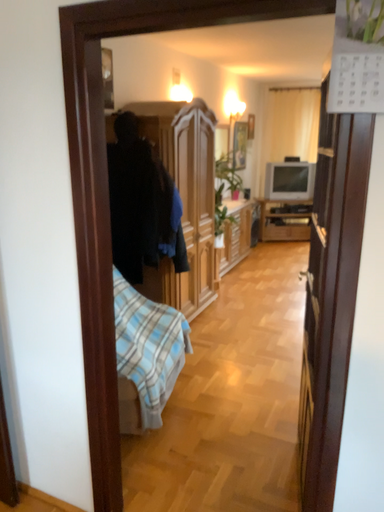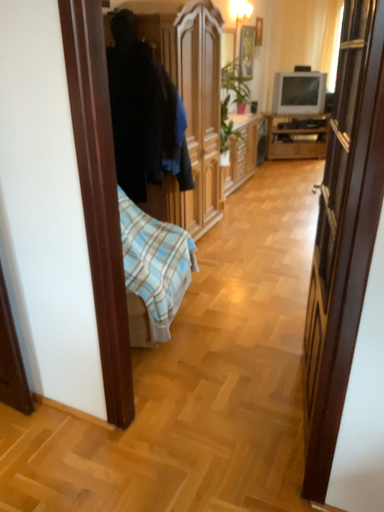
Question: Which way did the camera rotate in the video?

Choices:
 (A) rotated downward
 (B) rotated upward

Answer: (A)